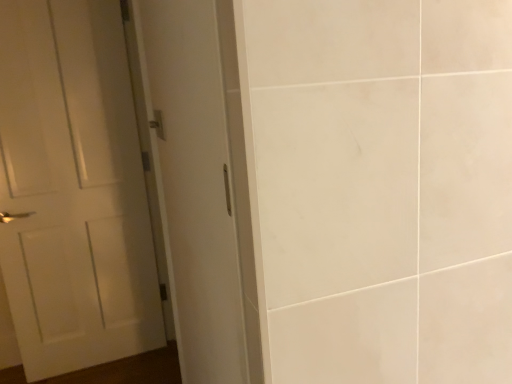
Question: Does metallic silver door handle at upper left have a lesser height compared to white matte door at left?

Choices:
 (A) yes
 (B) no

Answer: (A)

Question: Is metallic silver door handle at upper left to the right of white matte door at left from the viewer's perspective?

Choices:
 (A) no
 (B) yes

Answer: (B)

Question: Considering the relative positions of metallic silver door handle at upper left and white matte door at left in the image provided, is metallic silver door handle at upper left in front of white matte door at left?

Choices:
 (A) yes
 (B) no

Answer: (A)

Question: From a real-world perspective, is metallic silver door handle at upper left physically below white matte door at left?

Choices:
 (A) no
 (B) yes

Answer: (A)

Question: Does metallic silver door handle at upper left touch white matte door at left?

Choices:
 (A) yes
 (B) no

Answer: (B)

Question: From a real-world perspective, is metallic silver door handle at upper left above or below white glossy door at left?

Choices:
 (A) above
 (B) below

Answer: (A)

Question: Is metallic silver door handle at upper left in front of or behind white glossy door at left in the image?

Choices:
 (A) front
 (B) behind

Answer: (A)

Question: In terms of size, does metallic silver door handle at upper left appear bigger or smaller than white glossy door at left?

Choices:
 (A) big
 (B) small

Answer: (B)

Question: Looking at their shapes, would you say metallic silver door handle at upper left is wider or thinner than white glossy door at left?

Choices:
 (A) wide
 (B) thin

Answer: (B)

Question: In terms of width, does white matte door at left look wider or thinner when compared to metallic silver door handle at upper left?

Choices:
 (A) wide
 (B) thin

Answer: (A)

Question: Would you say white matte door at left is inside or outside metallic silver door handle at upper left?

Choices:
 (A) inside
 (B) outside

Answer: (B)

Question: Considering the relative positions of white matte door at left and metallic silver door handle at upper left in the image provided, is white matte door at left to the left or to the right of metallic silver door handle at upper left?

Choices:
 (A) left
 (B) right

Answer: (A)

Question: From a real-world perspective, is white matte door at left physically located above or below metallic silver door handle at upper left?

Choices:
 (A) above
 (B) below

Answer: (B)

Question: Does point (108, 211) appear closer or farther from the camera than point (237, 337)?

Choices:
 (A) closer
 (B) farther

Answer: (B)

Question: Considering their positions, is white matte door at left located in front of or behind white glossy door at left?

Choices:
 (A) behind
 (B) front

Answer: (A)